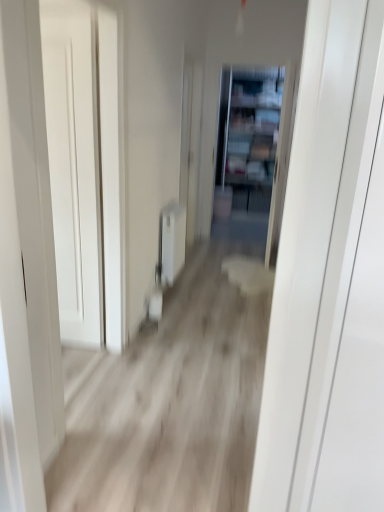
You are a GUI agent. You are given a task and a screenshot of the screen. Output one action in this format:
    pyautogui.click(x=<x>, y=<y>)
    Task: Click on the free point above clear glass bookshelf at center (from a real-world perspective)
    The image size is (384, 512).
    Given the screenshot: What is the action you would take?
    pyautogui.click(x=264, y=61)